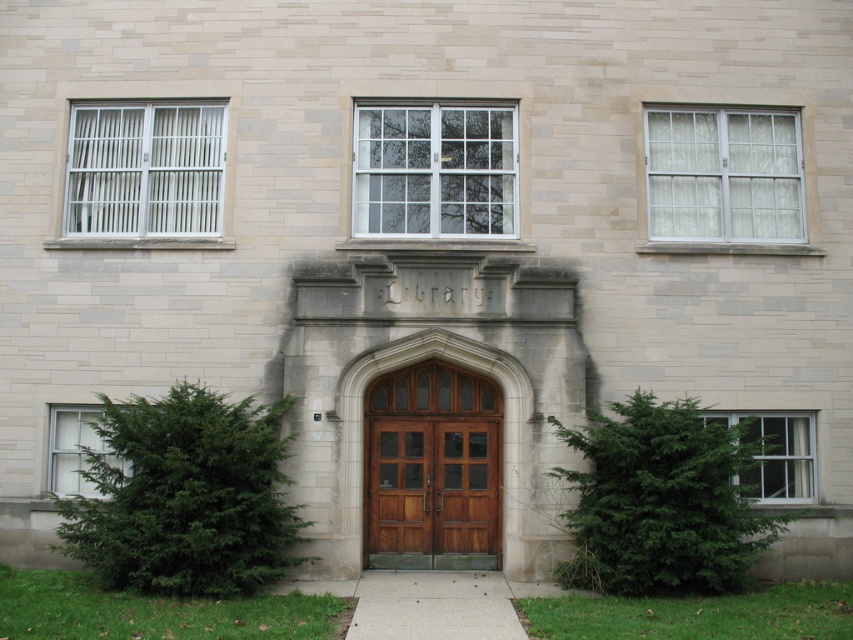
Question: Considering the relative positions of white glass window at upper right and clear glass window at lower left in the image provided, where is white glass window at upper right located with respect to clear glass window at lower left?

Choices:
 (A) left
 (B) right

Answer: (B)

Question: Which point is closer to the camera?

Choices:
 (A) (370, 392)
 (B) (813, 440)
 (C) (560, 476)
 (D) (648, 125)

Answer: (C)

Question: Estimate the real-world distances between objects in this image. Which object is closer to the white glass window at upper right?

Choices:
 (A) white metal bars at upper left
 (B) white glass window at lower right
 (C) brown wooden door at center

Answer: (B)

Question: Among these points, which one is nearest to the camera?

Choices:
 (A) (430, 406)
 (B) (82, 452)
 (C) (733, 417)

Answer: (C)

Question: Where is clear glass window at center located in relation to wooden door at center in the image?

Choices:
 (A) left
 (B) right

Answer: (B)

Question: Does green leafy tree at lower right have a smaller size compared to clear glass window at lower left?

Choices:
 (A) yes
 (B) no

Answer: (B)